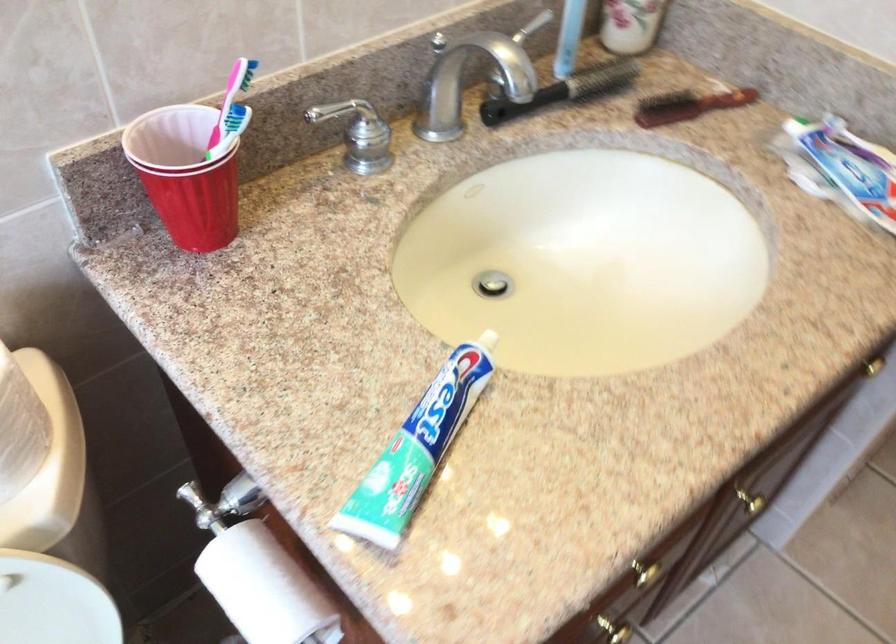
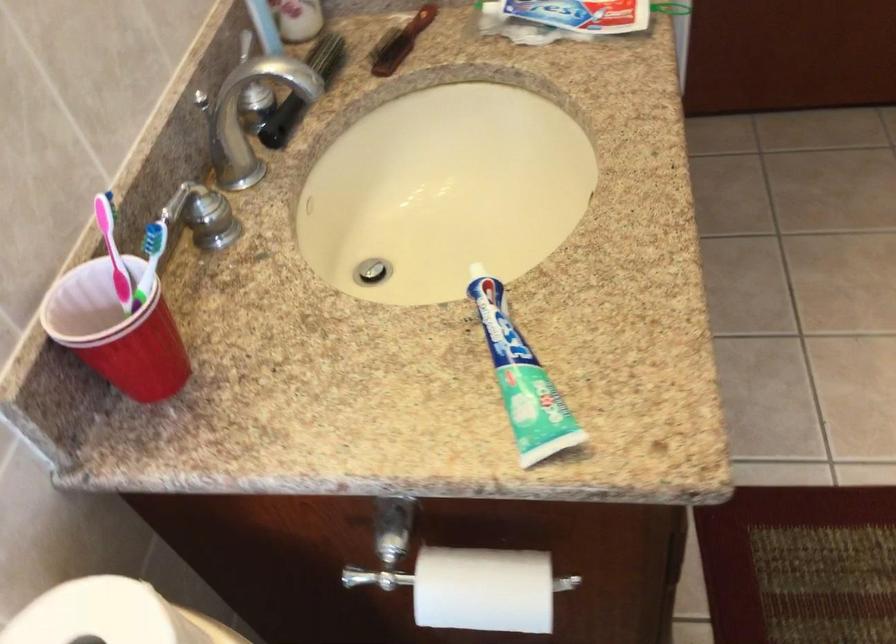
The point at (228, 109) is marked in the first image. Where is the corresponding point in the second image?

(113, 251)